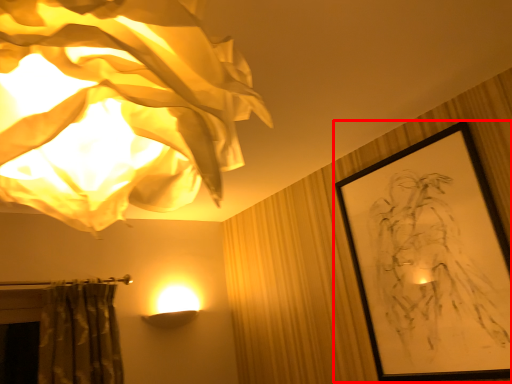
Question: From the image's perspective, where is picture frame (annotated by the red box) located in relation to lamp in the image?

Choices:
 (A) below
 (B) above

Answer: (A)